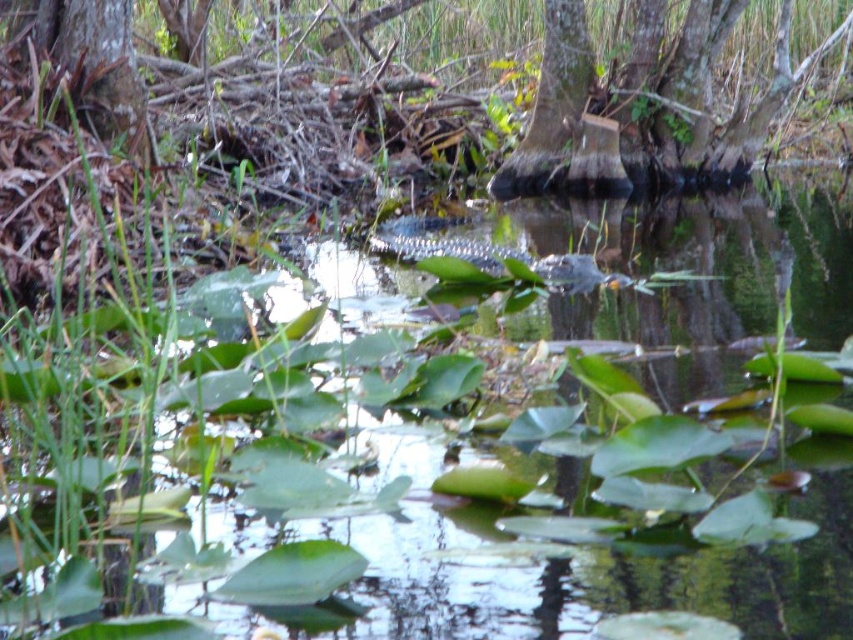
Question: Can you confirm if green glossy water at center is positioned to the left of smooth bark tree at center?

Choices:
 (A) no
 (B) yes

Answer: (B)

Question: Can you confirm if green glossy water at center is positioned below smooth bark tree at center?

Choices:
 (A) yes
 (B) no

Answer: (A)

Question: Which object is closer to the camera taking this photo?

Choices:
 (A) green glossy water at center
 (B) smooth bark tree at center

Answer: (A)

Question: Is green glossy water at center to the right of smooth bark tree at center from the viewer's perspective?

Choices:
 (A) no
 (B) yes

Answer: (A)